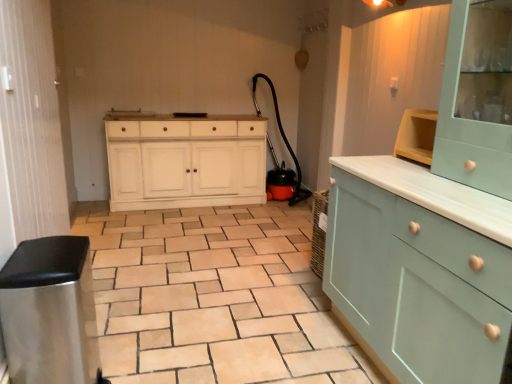
This screenshot has height=384, width=512. What are the coordinates of `light blue wood cabinet at center, the second cabinetry when ordered from top to bottom` in the screenshot? It's located at (420, 270).

Image resolution: width=512 pixels, height=384 pixels. Describe the element at coordinates (420, 270) in the screenshot. I see `light blue wood cabinet at center, placed as the first cabinetry when sorted from bottom to top` at that location.

Identify the location of light teal wood cabinet at upper right, which is counted as the first cabinetry, starting from the top. (475, 104).

Who is more distant, white painted wood cabinet at center or beige ceramic tile at center?

white painted wood cabinet at center is more distant.

From a real-world perspective, is white painted wood cabinet at center located higher than beige ceramic tile at center?

Yes, from a real-world perspective, white painted wood cabinet at center is above beige ceramic tile at center.

Considering the positions of point (180, 135) and point (158, 233), is point (180, 135) closer or farther from the camera than point (158, 233)?

Point (180, 135) appears to be farther away from the viewer than point (158, 233).

Which of these two, white painted wood cabinet at center or beige ceramic tile at center, is thinner?

With smaller width is white painted wood cabinet at center.

Between light teal wood cabinet at upper right, arranged as the 2th cabinetry when ordered from the bottom, and light blue wood cabinet at center, placed as the first cabinetry when sorted from bottom to top, which one has smaller width?

light teal wood cabinet at upper right, arranged as the 2th cabinetry when ordered from the bottom, is thinner.

Can you tell me how much light teal wood cabinet at upper right, which is counted as the first cabinetry, starting from the top, and light blue wood cabinet at center, the second cabinetry when ordered from top to bottom, differ in facing direction?

0.877 degrees.

Would you consider light teal wood cabinet at upper right, arranged as the 2th cabinetry when ordered from the bottom, to be distant from light blue wood cabinet at center, placed as the first cabinetry when sorted from bottom to top?

That's not correct — light teal wood cabinet at upper right, arranged as the 2th cabinetry when ordered from the bottom, is a little close to light blue wood cabinet at center, placed as the first cabinetry when sorted from bottom to top.

Between light teal wood cabinet at upper right, which is counted as the first cabinetry, starting from the top, and light blue wood cabinet at center, placed as the first cabinetry when sorted from bottom to top, which one has smaller size?

Smaller between the two is light teal wood cabinet at upper right, which is counted as the first cabinetry, starting from the top.

Is light teal wood cabinet at upper right, arranged as the 2th cabinetry when ordered from the bottom, not inside white painted wood cabinet at center?

light teal wood cabinet at upper right, arranged as the 2th cabinetry when ordered from the bottom, lies outside white painted wood cabinet at center's area.

Who is bigger, light teal wood cabinet at upper right, which is counted as the first cabinetry, starting from the top, or white painted wood cabinet at center?

Bigger between the two is white painted wood cabinet at center.

Considering the relative sizes of light teal wood cabinet at upper right, which is counted as the first cabinetry, starting from the top, and white painted wood cabinet at center in the image provided, is light teal wood cabinet at upper right, which is counted as the first cabinetry, starting from the top, shorter than white painted wood cabinet at center?

Indeed, light teal wood cabinet at upper right, which is counted as the first cabinetry, starting from the top, has a lesser height compared to white painted wood cabinet at center.

From the image's perspective, who appears lower, light teal wood cabinet at upper right, arranged as the 2th cabinetry when ordered from the bottom, or white painted wood cabinet at center?

From the image's view, white painted wood cabinet at center is below.

Is white painted wood cabinet at center inside the boundaries of light teal wood cabinet at upper right, arranged as the 2th cabinetry when ordered from the bottom, or outside?

white painted wood cabinet at center cannot be found inside light teal wood cabinet at upper right, arranged as the 2th cabinetry when ordered from the bottom.

Between white painted wood cabinet at center and light teal wood cabinet at upper right, which is counted as the first cabinetry, starting from the top, which one has less height?

light teal wood cabinet at upper right, which is counted as the first cabinetry, starting from the top, is shorter.

Is the surface of white painted wood cabinet at center in direct contact with light teal wood cabinet at upper right, arranged as the 2th cabinetry when ordered from the bottom?

No, white painted wood cabinet at center is not making contact with light teal wood cabinet at upper right, arranged as the 2th cabinetry when ordered from the bottom.

Is white painted wood cabinet at center bigger than light teal wood cabinet at upper right, arranged as the 2th cabinetry when ordered from the bottom?

Indeed, white painted wood cabinet at center has a larger size compared to light teal wood cabinet at upper right, arranged as the 2th cabinetry when ordered from the bottom.

Can you confirm if beige ceramic tile at center is positioned to the left of light blue wood cabinet at center, the second cabinetry when ordered from top to bottom?

Yes, beige ceramic tile at center is to the left of light blue wood cabinet at center, the second cabinetry when ordered from top to bottom.

From the picture: From the image's perspective, between beige ceramic tile at center and light blue wood cabinet at center, placed as the first cabinetry when sorted from bottom to top, which one is located above?

light blue wood cabinet at center, placed as the first cabinetry when sorted from bottom to top, appears higher in the image.

Considering the relative sizes of beige ceramic tile at center and white painted wood cabinet at center in the image provided, is beige ceramic tile at center taller than white painted wood cabinet at center?

No, beige ceramic tile at center is not taller than white painted wood cabinet at center.

You are a GUI agent. You are given a task and a screenshot of the screen. Output one action in this format:
    pyautogui.click(x=<x>, y=<y>)
    Task: Click on the chest of drawers above the beige ceramic tile at center (from the image's perspective)
    This screenshot has height=384, width=512.
    Given the screenshot: What is the action you would take?
    pyautogui.click(x=186, y=161)

Between beige ceramic tile at center and white painted wood cabinet at center, which one is positioned in front?

beige ceramic tile at center.

Is beige ceramic tile at center next to white painted wood cabinet at center and touching it?

beige ceramic tile at center and white painted wood cabinet at center are clearly separated.

Do you think light teal wood cabinet at upper right, which is counted as the first cabinetry, starting from the top, is within beige ceramic tile at center, or outside of it?

The correct answer is: outside.

From the image's perspective, which object appears higher, light teal wood cabinet at upper right, arranged as the 2th cabinetry when ordered from the bottom, or beige ceramic tile at center?

light teal wood cabinet at upper right, arranged as the 2th cabinetry when ordered from the bottom, from the image's perspective.

Identify the location of chest of drawers lying on the left of beige ceramic tile at center. This screenshot has width=512, height=384. (186, 161).

Identify the location of cabinetry lying on the right of light blue wood cabinet at center, the second cabinetry when ordered from top to bottom. The height and width of the screenshot is (384, 512). (475, 104).

Which object lies further to the anchor point beige ceramic tile at center, light teal wood cabinet at upper right, which is counted as the first cabinetry, starting from the top, or light blue wood cabinet at center, the second cabinetry when ordered from top to bottom?

Among the two, light teal wood cabinet at upper right, which is counted as the first cabinetry, starting from the top, is located further to beige ceramic tile at center.

From the image, which object appears to be farther from beige ceramic tile at center, light blue wood cabinet at center, placed as the first cabinetry when sorted from bottom to top, or white painted wood cabinet at center?

Based on the image, white painted wood cabinet at center appears to be further to beige ceramic tile at center.

Considering their positions, is beige ceramic tile at center positioned further to white painted wood cabinet at center than light blue wood cabinet at center, the second cabinetry when ordered from top to bottom?

light blue wood cabinet at center, the second cabinetry when ordered from top to bottom, is positioned further to the anchor white painted wood cabinet at center.

Which object lies nearer to the anchor point light teal wood cabinet at upper right, arranged as the 2th cabinetry when ordered from the bottom, white painted wood cabinet at center or beige ceramic tile at center?

The object closer to light teal wood cabinet at upper right, arranged as the 2th cabinetry when ordered from the bottom, is beige ceramic tile at center.

Looking at this image, when comparing their distances from light blue wood cabinet at center, placed as the first cabinetry when sorted from bottom to top, does light teal wood cabinet at upper right, arranged as the 2th cabinetry when ordered from the bottom, or white painted wood cabinet at center seem further?

Among the two, white painted wood cabinet at center is located further to light blue wood cabinet at center, placed as the first cabinetry when sorted from bottom to top.

Estimate the real-world distances between objects in this image. Which object is further from light blue wood cabinet at center, the second cabinetry when ordered from top to bottom, white painted wood cabinet at center or light teal wood cabinet at upper right, which is counted as the first cabinetry, starting from the top?

The object further to light blue wood cabinet at center, the second cabinetry when ordered from top to bottom, is white painted wood cabinet at center.

Estimate the real-world distances between objects in this image. Which object is further from light teal wood cabinet at upper right, arranged as the 2th cabinetry when ordered from the bottom, light blue wood cabinet at center, placed as the first cabinetry when sorted from bottom to top, or beige ceramic tile at center?

beige ceramic tile at center is positioned further to the anchor light teal wood cabinet at upper right, arranged as the 2th cabinetry when ordered from the bottom.

Looking at the image, which one is located closer to light teal wood cabinet at upper right, arranged as the 2th cabinetry when ordered from the bottom, beige ceramic tile at center or light blue wood cabinet at center, the second cabinetry when ordered from top to bottom?

light blue wood cabinet at center, the second cabinetry when ordered from top to bottom, lies closer to light teal wood cabinet at upper right, arranged as the 2th cabinetry when ordered from the bottom, than the other object.

Identify the location of cabinetry between beige ceramic tile at center and light teal wood cabinet at upper right, which is counted as the first cabinetry, starting from the top, in the horizontal direction. (420, 270).

Identify the location of cabinetry between light blue wood cabinet at center, placed as the first cabinetry when sorted from bottom to top, and white painted wood cabinet at center in the front-back direction. Image resolution: width=512 pixels, height=384 pixels. (475, 104).

I want to click on ceramic tile between light blue wood cabinet at center, the second cabinetry when ordered from top to bottom, and white painted wood cabinet at center, along the z-axis, so click(x=214, y=298).

Identify the location of ceramic tile between light teal wood cabinet at upper right, arranged as the 2th cabinetry when ordered from the bottom, and white painted wood cabinet at center, along the z-axis. This screenshot has height=384, width=512. (214, 298).